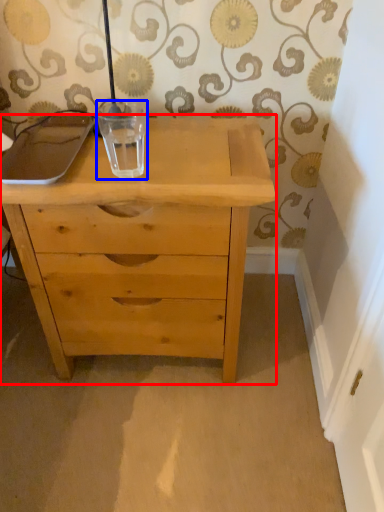
Question: Which of the following is the farthest to the observer, chest of drawers (highlighted by a red box) or glass vase (highlighted by a blue box)?

Choices:
 (A) chest of drawers
 (B) glass vase

Answer: (B)